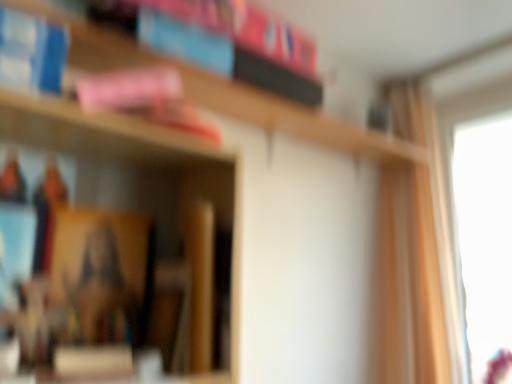
Question: Is the depth of light beige fabric curtain at right greater than that of wooden bookshelf at upper center?

Choices:
 (A) no
 (B) yes

Answer: (B)

Question: Is light beige fabric curtain at right not inside wooden bookshelf at upper center?

Choices:
 (A) yes
 (B) no

Answer: (A)

Question: Can you confirm if light beige fabric curtain at right is thinner than wooden bookshelf at upper center?

Choices:
 (A) yes
 (B) no

Answer: (A)

Question: Is light beige fabric curtain at right positioned in front of wooden bookshelf at upper center?

Choices:
 (A) yes
 (B) no

Answer: (B)

Question: Is light beige fabric curtain at right to the right of wooden bookshelf at upper center from the viewer's perspective?

Choices:
 (A) no
 (B) yes

Answer: (B)

Question: Is light beige fabric curtain at right oriented towards wooden bookshelf at upper center?

Choices:
 (A) yes
 (B) no

Answer: (A)

Question: Would you say wooden bookshelf at upper center is a long distance from light beige fabric curtain at right?

Choices:
 (A) no
 (B) yes

Answer: (A)

Question: From the image's perspective, would you say wooden bookshelf at upper center is positioned over light beige fabric curtain at right?

Choices:
 (A) no
 (B) yes

Answer: (B)

Question: Considering the relative sizes of wooden bookshelf at upper center and light beige fabric curtain at right in the image provided, is wooden bookshelf at upper center shorter than light beige fabric curtain at right?

Choices:
 (A) yes
 (B) no

Answer: (A)

Question: Is wooden bookshelf at upper center at the left side of light beige fabric curtain at right?

Choices:
 (A) no
 (B) yes

Answer: (B)

Question: Does wooden bookshelf at upper center have a lesser width compared to light beige fabric curtain at right?

Choices:
 (A) yes
 (B) no

Answer: (B)

Question: Is wooden bookshelf at upper center aimed at light beige fabric curtain at right?

Choices:
 (A) no
 (B) yes

Answer: (A)

Question: Considering their positions, is wooden bookshelf at upper center located in front of or behind light beige fabric curtain at right?

Choices:
 (A) front
 (B) behind

Answer: (A)